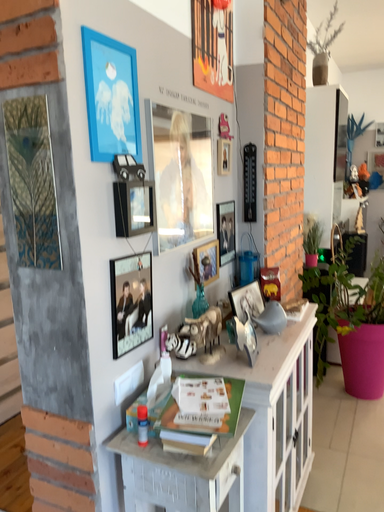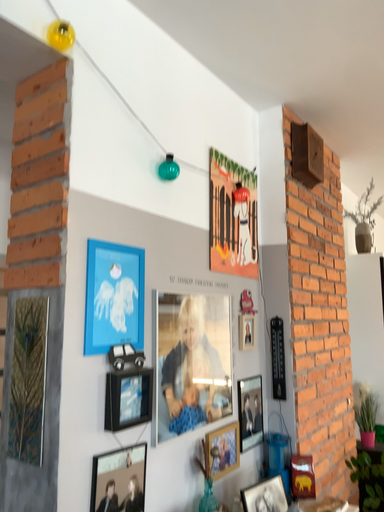
Question: Which way did the camera rotate in the video?

Choices:
 (A) rotated downward
 (B) rotated upward

Answer: (B)